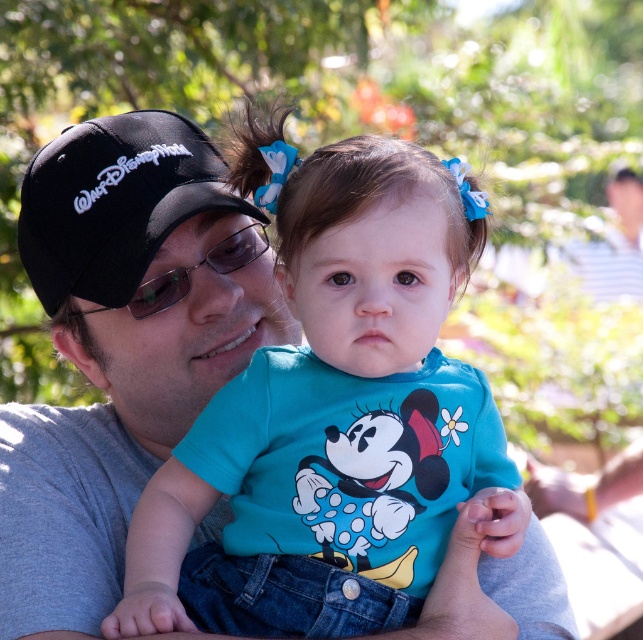
You are a photographer trying to capture a closeup of the black fabric baseball cap at left without including the turquoise fabric shirt at center in the frame. Given their sizes, is this possible?

The turquoise fabric shirt at center is wider than the black fabric baseball cap at left, so it might be challenging to frame the cap without including the shirt since the shirt is larger in width.

You are a photographer trying to capture a candid shot of the sunglasses at center and the turquoise fabric shirt at center. Which object should you focus on first if you want to photograph the one closer to the camera?

The sunglasses at center is closer to the camera than the turquoise fabric shirt at center, so you should focus on the sunglasses at center first.

Consider the image. You are a photographer trying to capture a closeup of the turquoise fabric shirt at center without the sunglasses at center blocking the view. Is this possible based on their positions?

The turquoise fabric shirt at center is in front of the sunglasses at center, so you can capture a closeup of the turquoise fabric shirt at center without the sunglasses at center blocking the view.